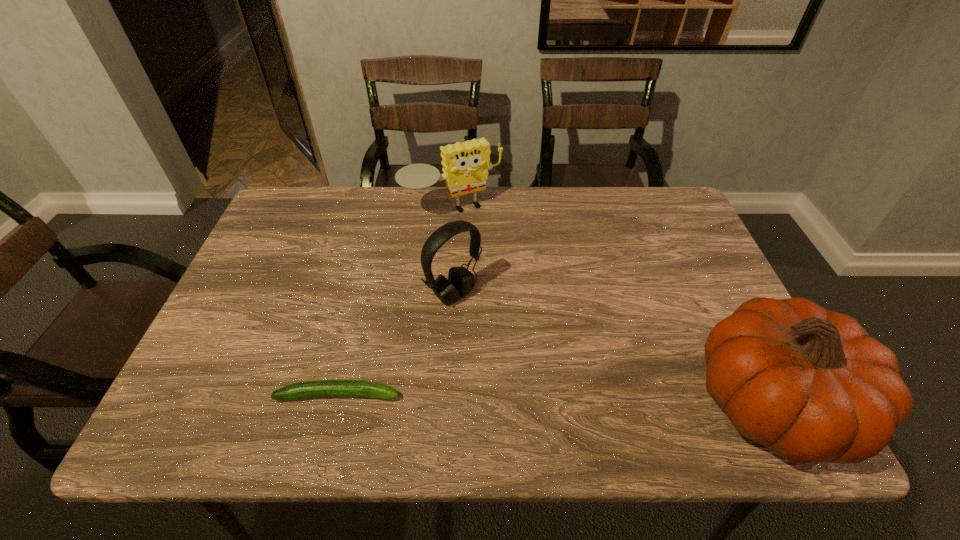
What are the coordinates of `free space on the desktop that is between the shortest object and the pumpkin and is positioned on the front-facing side of the sponge` in the screenshot? It's located at (567, 399).

You are a GUI agent. You are given a task and a screenshot of the screen. Output one action in this format:
    pyautogui.click(x=<x>, y=<y>)
    Task: Click on the free spot on the desktop that is between the shortest object and the pumpkin and is positioned on the front-facing side of the second farthest object
    The width and height of the screenshot is (960, 540).
    Given the screenshot: What is the action you would take?
    pyautogui.click(x=567, y=399)